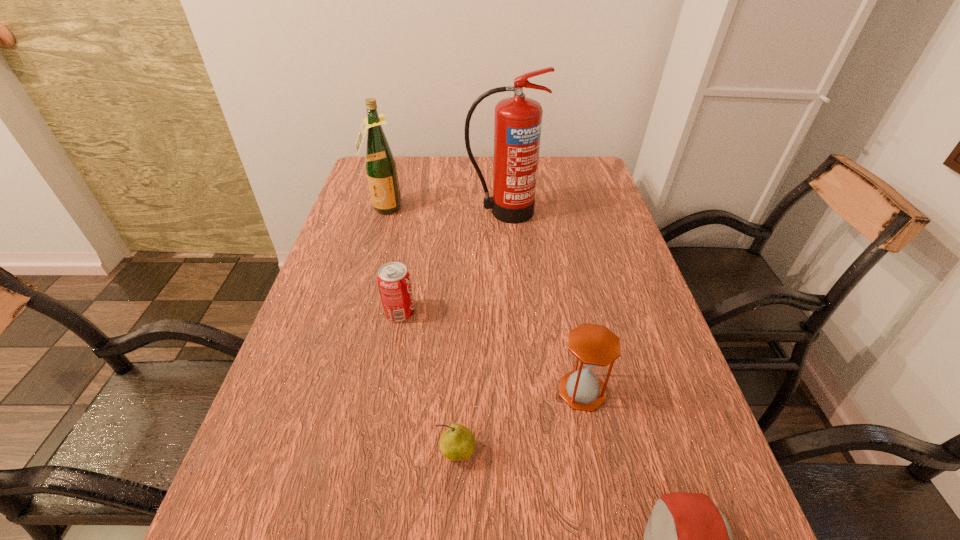
This screenshot has height=540, width=960. What are the coordinates of `vacant area between the fourth farthest object and the tallest object` in the screenshot? It's located at pos(542,301).

Where is `vacant region between the fire extinguisher and the hourglass`? The width and height of the screenshot is (960, 540). vacant region between the fire extinguisher and the hourglass is located at coordinates (542, 301).

Locate an element on the screen. vacant space that is in between the fifth shortest object and the fourth farthest object is located at coordinates (483, 300).

You are a GUI agent. You are given a task and a screenshot of the screen. Output one action in this format:
    pyautogui.click(x=<x>, y=<y>)
    Task: Click on the free space between the fire extinguisher and the soda can
    This screenshot has width=960, height=540.
    Given the screenshot: What is the action you would take?
    pyautogui.click(x=451, y=262)

At what (x,y) coordinates should I click in order to perform the action: click on vacant area between the fourth nearest object and the third nearest object. Please return your answer as a coordinate pair (x, y). This screenshot has height=540, width=960. Looking at the image, I should click on (491, 352).

The image size is (960, 540). I want to click on the third closest object to the hourglass, so click(x=394, y=282).

Find the location of `the fourth closest object relative to the third farthest object`. the fourth closest object relative to the third farthest object is located at coordinates (380, 164).

Find the location of a particular element. vacant region that satisfies the following two spatial constraints: 1. on the front-facing side of the second tallest object; 2. on the left side of the third nearest object is located at coordinates (330, 391).

Identify the location of free space that satisfies the following two spatial constraints: 1. on the front-facing side of the soda can; 2. on the right side of the leftmost object. (353, 312).